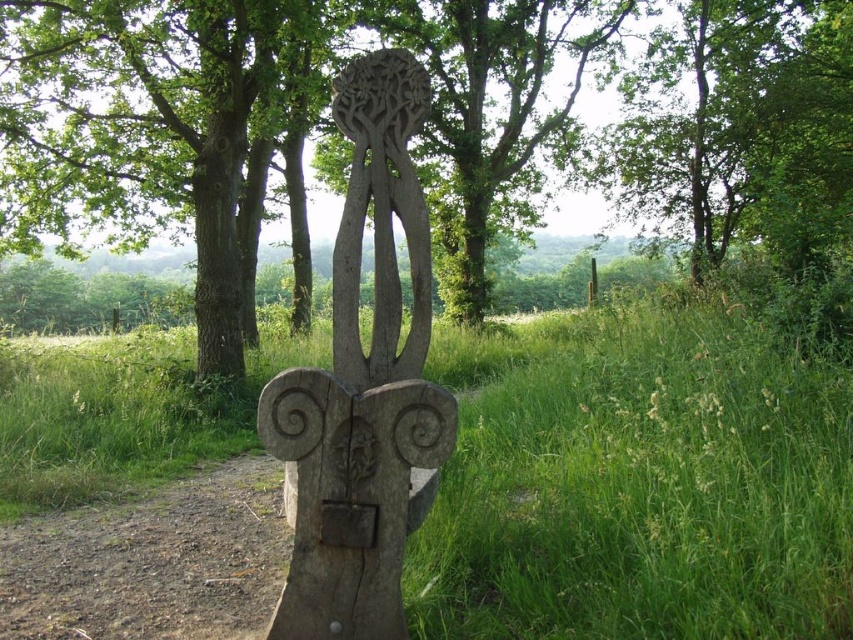
Question: Is smooth brown tree trunk at center to the left of wooden carving at center from the viewer's perspective?

Choices:
 (A) no
 (B) yes

Answer: (B)

Question: In this image, where is smooth brown tree trunk at center located relative to wooden carving at center?

Choices:
 (A) above
 (B) below

Answer: (A)

Question: Can you confirm if natural wood carving at center is thinner than brown rough tree trunk at center?

Choices:
 (A) no
 (B) yes

Answer: (A)

Question: Which of the following is the closest to the observer?

Choices:
 (A) green grass at center
 (B) wooden carving at center
 (C) natural wood carving at center

Answer: (A)

Question: Based on their relative distances, which object is nearer to the green grass at center?

Choices:
 (A) brown rough tree trunk at center
 (B) natural wood carving at center

Answer: (A)

Question: Which object appears closest to the camera in this image?

Choices:
 (A) brown rough tree trunk at center
 (B) green grass at center
 (C) wooden carving at center

Answer: (B)